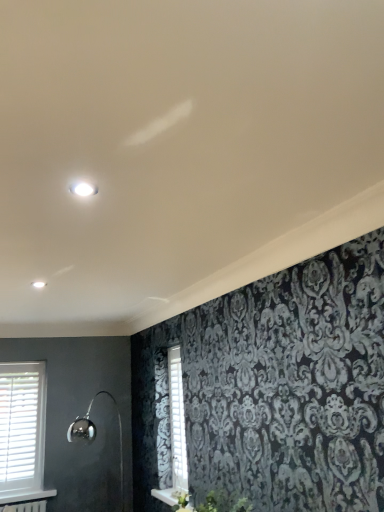
Question: From a real-world perspective, is polished chrome shower at lower left below white wooden window at lower left?

Choices:
 (A) no
 (B) yes

Answer: (B)

Question: Could you tell me if polished chrome shower at lower left is facing white wooden window at lower left?

Choices:
 (A) yes
 (B) no

Answer: (B)

Question: Is polished chrome shower at lower left closer to the viewer compared to white wooden window at lower left?

Choices:
 (A) no
 (B) yes

Answer: (B)

Question: Does polished chrome shower at lower left appear on the left side of white wooden window at lower left?

Choices:
 (A) yes
 (B) no

Answer: (B)

Question: From the image's perspective, would you say polished chrome shower at lower left is shown under white wooden window at lower left?

Choices:
 (A) yes
 (B) no

Answer: (A)

Question: Can white wooden window at lower left be found inside polished chrome shower at lower left?

Choices:
 (A) yes
 (B) no

Answer: (B)

Question: Is white wooden window at lower left thinner than polished chrome shower at lower left?

Choices:
 (A) no
 (B) yes

Answer: (B)

Question: Can you confirm if white wooden window at lower left is smaller than polished chrome shower at lower left?

Choices:
 (A) no
 (B) yes

Answer: (B)

Question: From a real-world perspective, is white wooden window at lower left physically below polished chrome shower at lower left?

Choices:
 (A) no
 (B) yes

Answer: (A)

Question: Is the depth of white wooden window at lower left greater than that of polished chrome shower at lower left?

Choices:
 (A) yes
 (B) no

Answer: (A)

Question: Could polished chrome shower at lower left be considered to be inside white wooden window at lower left?

Choices:
 (A) no
 (B) yes

Answer: (A)

Question: Does white wooden window at lower left have a lesser height compared to polished chrome shower at lower left?

Choices:
 (A) yes
 (B) no

Answer: (B)

Question: Considering the relative positions of polished chrome shower at lower left and white wooden shutter at center in the image provided, is polished chrome shower at lower left to the right of white wooden shutter at center from the viewer's perspective?

Choices:
 (A) yes
 (B) no

Answer: (B)